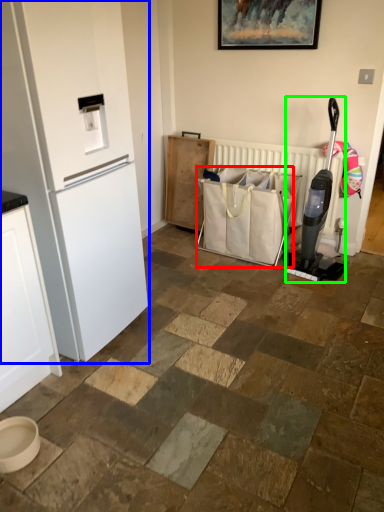
Question: Based on their relative distances, which object is nearer to shopping bag (highlighted by a red box)? Choose from refrigerator (highlighted by a blue box) and appliance (highlighted by a green box).

Choices:
 (A) refrigerator
 (B) appliance

Answer: (B)